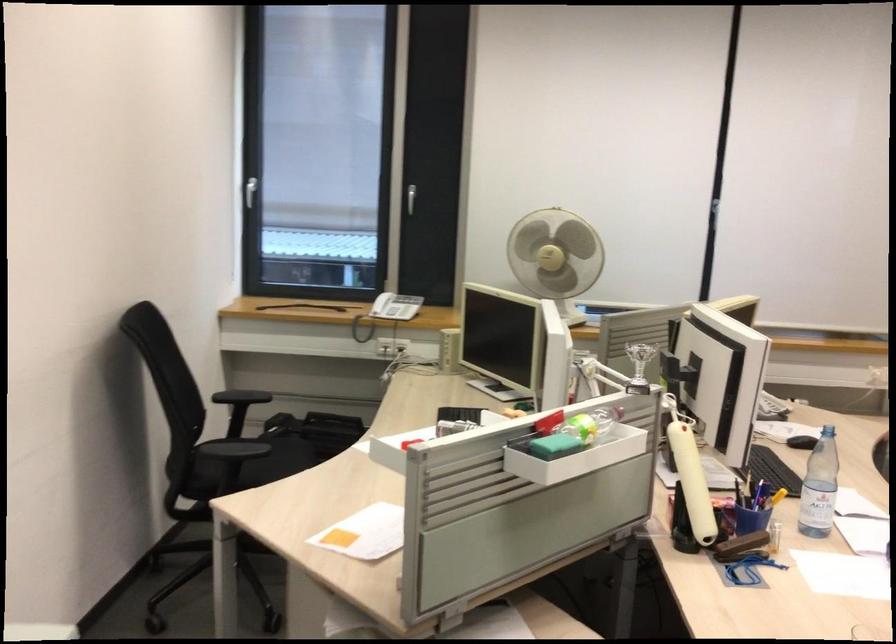
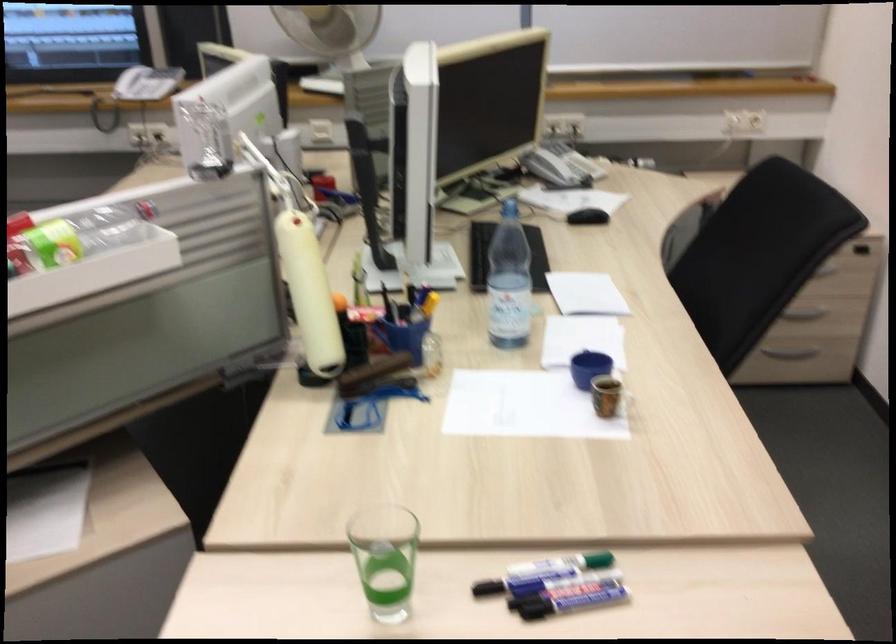
Question: How did the camera likely rotate?

Choices:
 (A) Left
 (B) Right
 (C) Up
 (D) Down

Answer: (D)